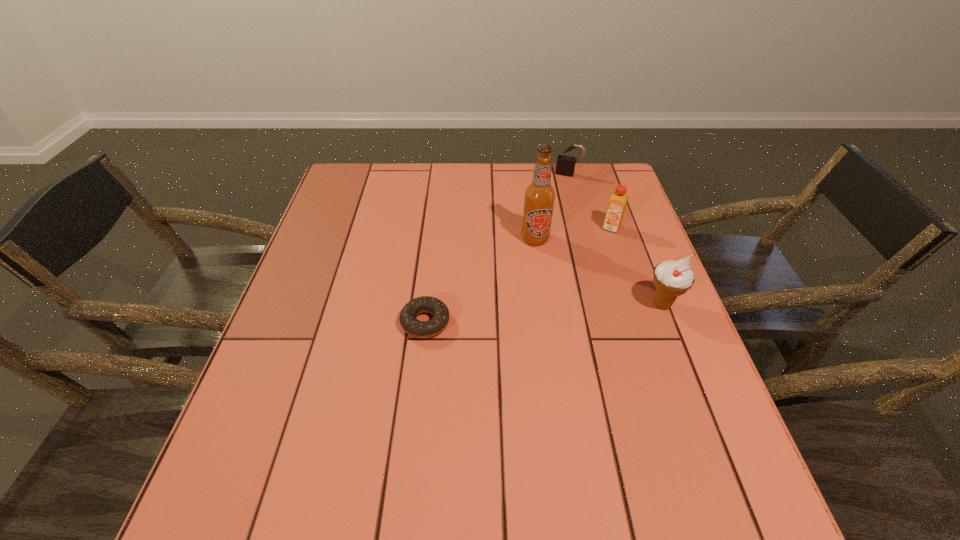
Find the location of `vacant area located 0.340m on the front and back of the orange juice`. vacant area located 0.340m on the front and back of the orange juice is located at coordinates (575, 319).

Where is `vacant space situated on the front and back of the orange juice`? vacant space situated on the front and back of the orange juice is located at coordinates (602, 251).

The width and height of the screenshot is (960, 540). Find the location of `free region located on the front and back of the orange juice`. free region located on the front and back of the orange juice is located at coordinates (586, 293).

Image resolution: width=960 pixels, height=540 pixels. What are the coordinates of `vacant space situated 0.240m with the keyhole on the front of the padlock` in the screenshot? It's located at (551, 220).

Find the location of a particular element. The height and width of the screenshot is (540, 960). vacant space located with the keyhole on the front of the padlock is located at coordinates (554, 211).

Find the location of a particular element. The width and height of the screenshot is (960, 540). vacant space situated 0.230m with the keyhole on the front of the padlock is located at coordinates (552, 219).

The image size is (960, 540). I want to click on free space located 0.060m on the front label of the second object from left to right, so click(x=535, y=264).

The width and height of the screenshot is (960, 540). What are the coordinates of `vacant space located on the front label of the second object from left to right` in the screenshot? It's located at tap(536, 269).

In order to click on free spot located on the front label of the second object from left to right in this screenshot , I will do `click(536, 327)`.

At what (x,y) coordinates should I click in order to perform the action: click on object at the far edge. Please return your answer as a coordinate pair (x, y). Looking at the image, I should click on (565, 164).